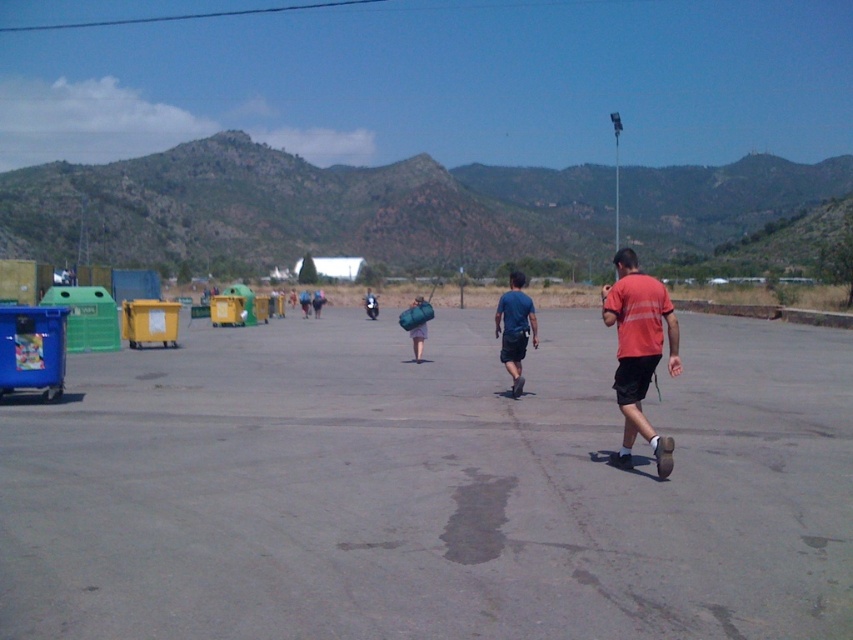
You are standing at the entrance of the parking lot and need to reach the gray asphalt parking lot at center. Which direction should you walk to get there?

The gray asphalt parking lot at center is located at point (430,488), so you should walk towards the center of the image to reach it.

You are standing in the open paved area and want to take a photo of both the point at coordinates point (142, 452) and point (374, 314). Which point should you focus on first to ensure both are in the frame?

You should focus on point (142, 452) first because it is closer to the camera than point (374, 314), ensuring both points are within the frame.